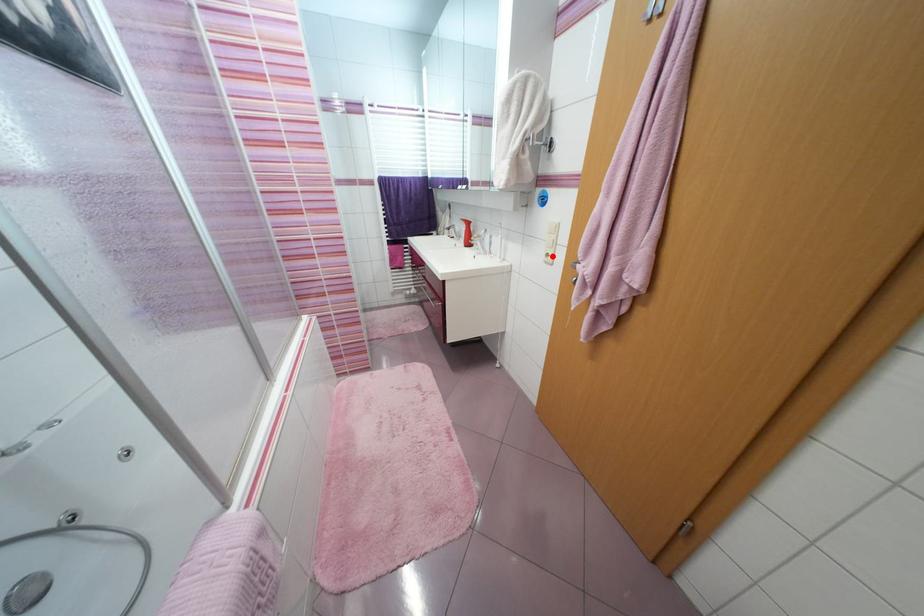
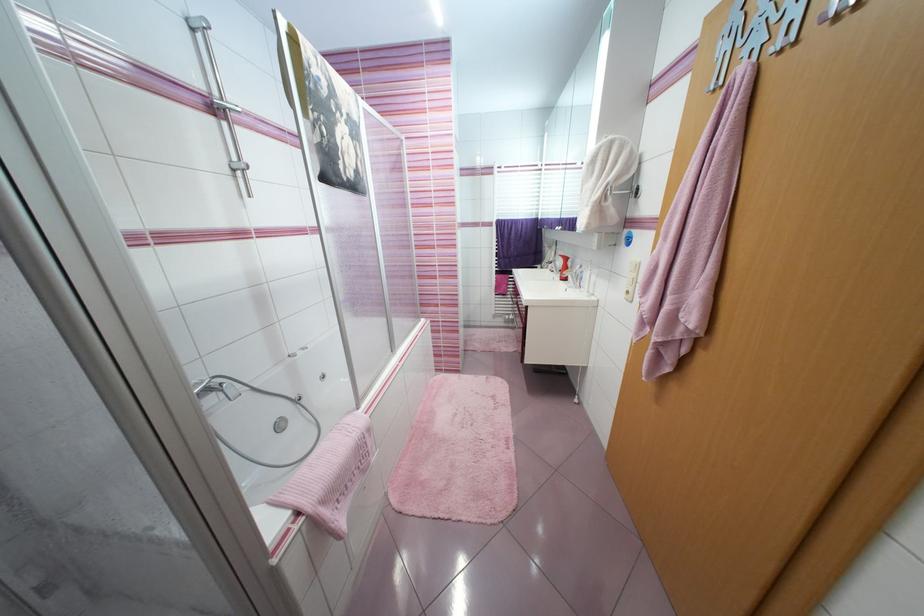
The point at the highlighted location is marked in the first image. Where is the corresponding point in the second image?

(633, 293)